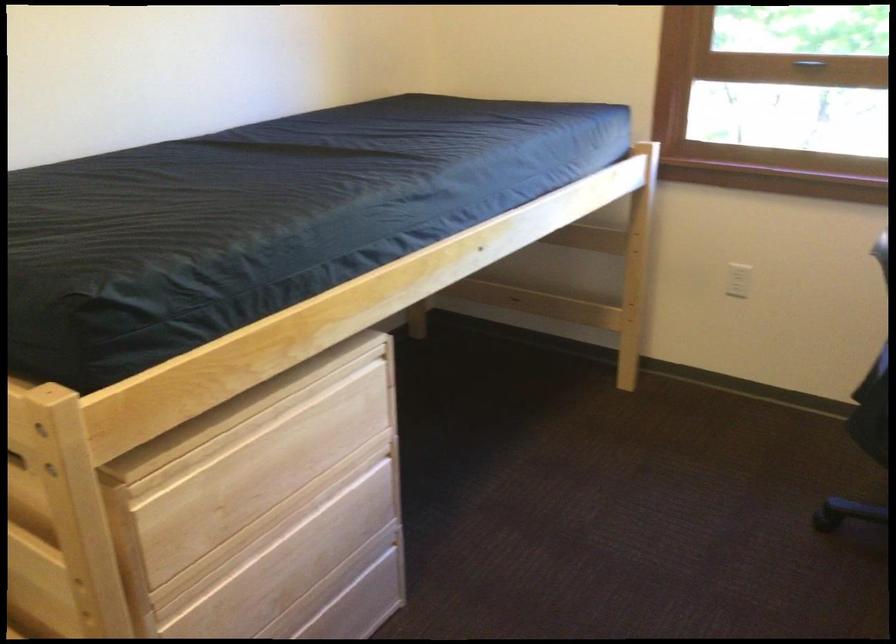
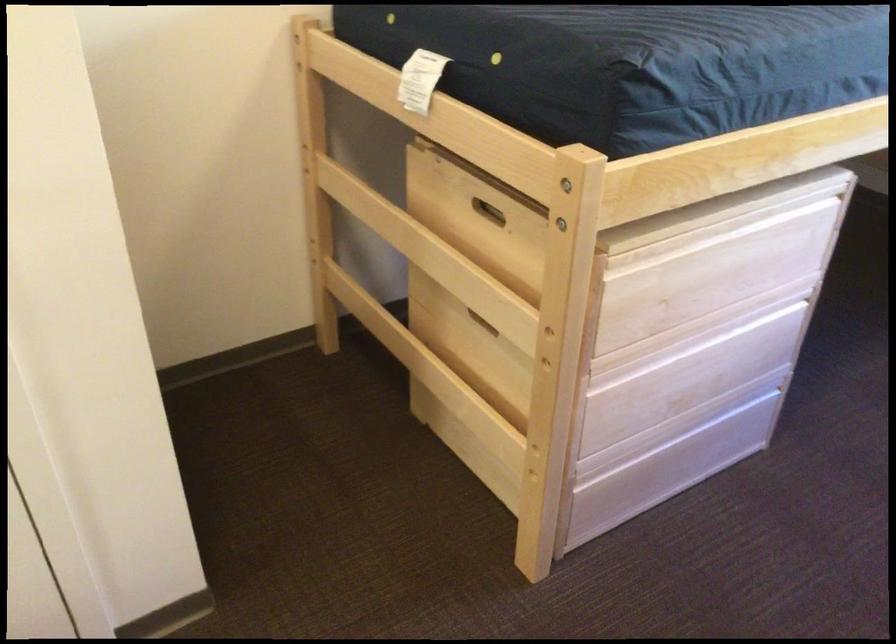
What movement of the cameraman would produce the second image?

The cameraman walked toward left, backward.